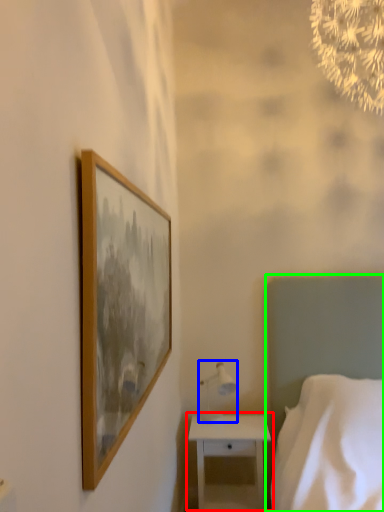
Question: Based on their relative distances, which object is nearer to nightstand (highlighted by a red box)? Choose from table lamp (highlighted by a blue box) and bed (highlighted by a green box).

Choices:
 (A) table lamp
 (B) bed

Answer: (A)